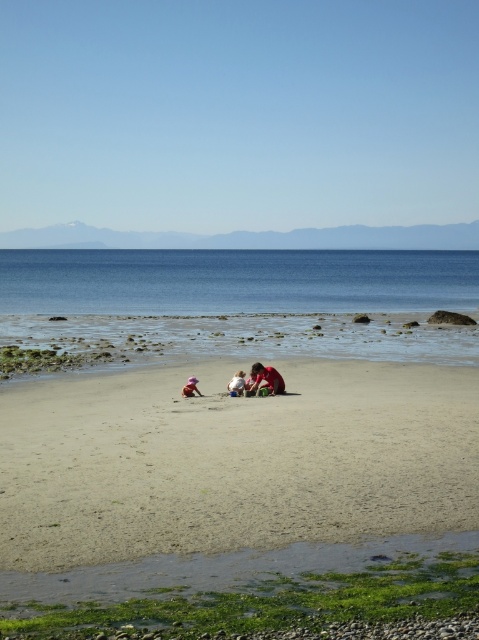
You are standing at the point marked as point (232, 460) in the image. Looking around, you see light brown sand at center. Which direction should you walk to reach the shallow tide pool in the bottom right corner?

Since point (232, 460) is on light brown sand at center, you should walk towards the bottom right direction to reach the shallow tide pool in the bottom right corner.